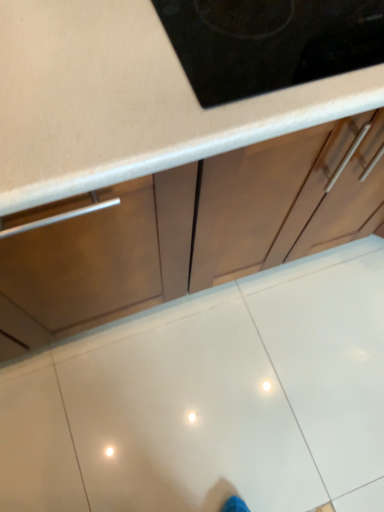
What is the approximate height of matte brown cabinet at center?

33.54 inches.

Image resolution: width=384 pixels, height=512 pixels. I want to click on matte brown cabinet at center, so click(191, 231).

Describe the element at coordinates (191, 231) in the screenshot. I see `matte brown cabinet at center` at that location.

What do you see at coordinates (185, 414) in the screenshot? I see `white glossy tile at center` at bounding box center [185, 414].

Where is `white glossy tile at center`? white glossy tile at center is located at coordinates (185, 414).

Locate an element on the screen. Image resolution: width=384 pixels, height=512 pixels. matte brown cabinet at center is located at coordinates (191, 231).

Would you say white glossy tile at center is to the left or to the right of matte brown cabinet at center in the picture?

white glossy tile at center is positioned on matte brown cabinet at center's right side.

Is white glossy tile at center further to camera compared to matte brown cabinet at center?

Yes, it is.

Does point (220, 338) come in front of point (101, 196)?

No, it is not.

From the image's perspective, who appears lower, white glossy tile at center or matte brown cabinet at center?

white glossy tile at center appears lower in the image.

From a real-world perspective, who is located higher, white glossy tile at center or matte brown cabinet at center?

matte brown cabinet at center is physically above.

Is white glossy tile at center wider or thinner than matte brown cabinet at center?

In the image, white glossy tile at center appears to be wider than matte brown cabinet at center.

Considering the sizes of white glossy tile at center and matte brown cabinet at center in the image, is white glossy tile at center taller or shorter than matte brown cabinet at center?

Clearly, white glossy tile at center is shorter compared to matte brown cabinet at center.

Considering the relative sizes of white glossy tile at center and matte brown cabinet at center in the image provided, is white glossy tile at center smaller than matte brown cabinet at center?

Indeed, white glossy tile at center has a smaller size compared to matte brown cabinet at center.

Would you say white glossy tile at center is outside matte brown cabinet at center?

Yes, white glossy tile at center is located beyond the bounds of matte brown cabinet at center.

Are white glossy tile at center and matte brown cabinet at center making contact?

No, white glossy tile at center is not beside matte brown cabinet at center.

Is white glossy tile at center looking in the opposite direction of matte brown cabinet at center?

No, white glossy tile at center's orientation is not away from matte brown cabinet at center.

How distant is white glossy tile at center from matte brown cabinet at center?

white glossy tile at center and matte brown cabinet at center are 16.18 inches apart.

The width and height of the screenshot is (384, 512). In the image, there is a matte brown cabinet at center. Identify the location of tile below it (from a real-world perspective). (185, 414).

Does matte brown cabinet at center appear on the right side of white glossy tile at center?

No.

Is matte brown cabinet at center further to the viewer compared to white glossy tile at center?

No, the depth of matte brown cabinet at center is less than that of white glossy tile at center.

Is point (93, 232) closer or farther from the camera than point (223, 297)?

Point (93, 232).

From the image's perspective, would you say matte brown cabinet at center is shown under white glossy tile at center?

Actually, matte brown cabinet at center appears above white glossy tile at center in the image.

From a real-world perspective, is matte brown cabinet at center located higher than white glossy tile at center?

Yes.

Between matte brown cabinet at center and white glossy tile at center, which one has larger width?

With larger width is white glossy tile at center.

Considering the sizes of objects matte brown cabinet at center and white glossy tile at center in the image provided, who is taller, matte brown cabinet at center or white glossy tile at center?

Standing taller between the two is matte brown cabinet at center.

Which of these two, matte brown cabinet at center or white glossy tile at center, is smaller?

white glossy tile at center is smaller.

Is white glossy tile at center completely or partially inside matte brown cabinet at center?

No, matte brown cabinet at center does not contain white glossy tile at center.

Would you say matte brown cabinet at center is a long distance from white glossy tile at center?

No, matte brown cabinet at center is in close proximity to white glossy tile at center.

Is matte brown cabinet at center oriented away from white glossy tile at center?

No, matte brown cabinet at center's orientation is not away from white glossy tile at center.

What's the angular difference between matte brown cabinet at center and white glossy tile at center's facing directions?

The angle between the facing direction of matte brown cabinet at center and the facing direction of white glossy tile at center is 91 degrees.

Locate an element on the screen. The image size is (384, 512). tile lying behind the matte brown cabinet at center is located at coordinates (185, 414).

Where is `tile that is on the right side of matte brown cabinet at center`? tile that is on the right side of matte brown cabinet at center is located at coordinates (185, 414).

The width and height of the screenshot is (384, 512). Find the location of `tile behind the matte brown cabinet at center`. tile behind the matte brown cabinet at center is located at coordinates (185, 414).